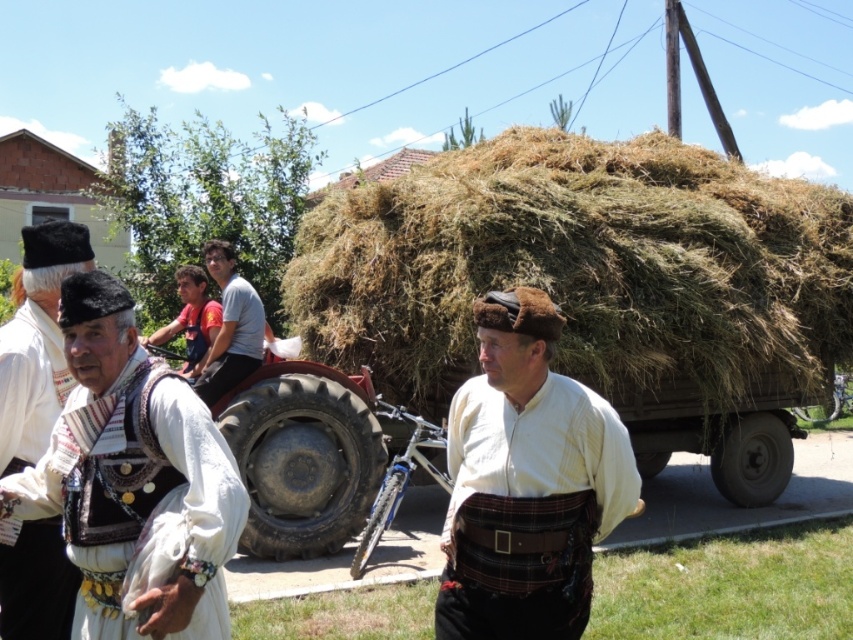
You are a photographer trying to capture the scene. You notice the brown dry hay at center and the light gray cotton shirt at center. Which object should you focus on if you want to capture the larger one in the image?

The brown dry hay at center is larger in size than the light gray cotton shirt at center, so you should focus on the brown dry hay at center to capture the larger one.

Looking at this image, you are a photographer standing at the edge of the road. You want to take a photo that includes both the brown dry hay at center and the light gray cotton shirt at center. Given that your camera has a maximum focus range of 9 feet, will both subjects be in focus?

The distance between the brown dry hay at center and the light gray cotton shirt at center is 8.97 feet, which is within the camera maximum focus range of 9 feet. Therefore, both subjects will be in focus.

You are a photographer positioned at the origin point of the image. You want to take a photo of the light gray cotton shirt at center. Which direction should you move your camera to capture it?

The light gray cotton shirt at center is located at point 0.512 on the x axis and 0.271 on the y axis. Since the origin is at the bottom left corner, you should move your camera to the right and slightly upwards to capture the light gray cotton shirt at center.